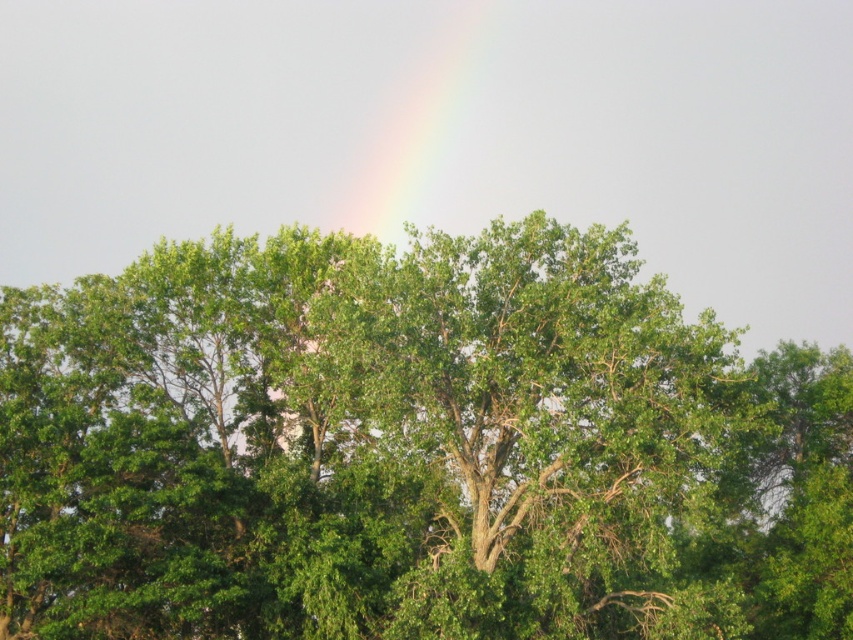
You are standing in the middle of the forest scene shown. There is a point marked at coordinates point (412, 449). What object in the image is located at this point?

The point (412, 449) corresponds to the green leafy tree at center.

You are an ornithologist observing this scene. You notice the green leafy tree at center and the rainbow at upper center. Which object is closer to your viewpoint?

The green leafy tree at center is closer to your viewpoint because it is positioned in front of the rainbow at upper center.